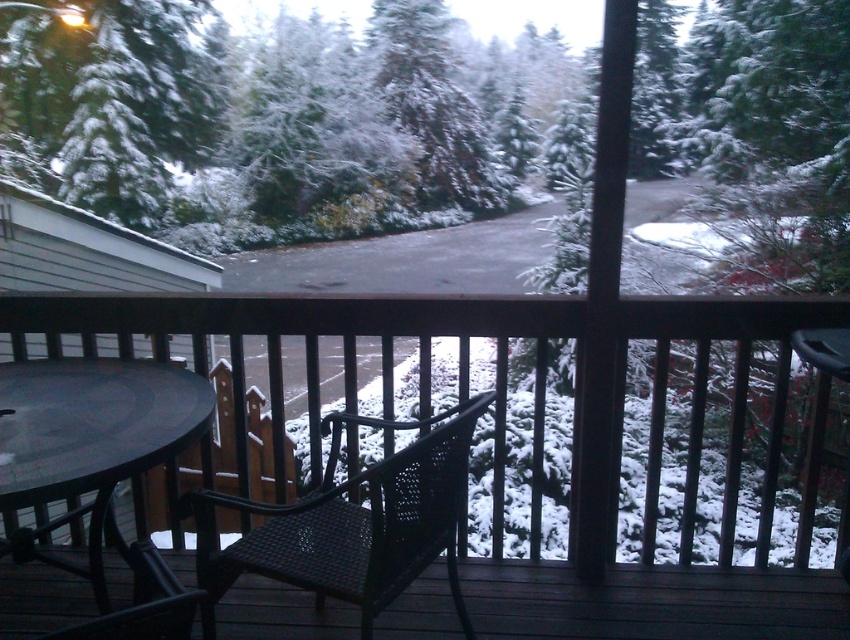
Question: In this image, where is matte black chair at center located relative to black matte table at lower left?

Choices:
 (A) above
 (B) below

Answer: (A)

Question: Which of the following is the farthest from the observer?

Choices:
 (A) (15, 460)
 (B) (697, 298)
 (C) (446, 522)

Answer: (B)

Question: Which object is farther from the camera taking this photo?

Choices:
 (A) black mesh chair at center
 (B) black matte table at lower left
 (C) black wicker chair at center
 (D) matte black chair at center

Answer: (D)

Question: In this image, where is matte black chair at center located relative to black matte table at lower left?

Choices:
 (A) right
 (B) left

Answer: (A)

Question: Can you confirm if matte black chair at center is smaller than black matte table at lower left?

Choices:
 (A) no
 (B) yes

Answer: (A)

Question: Which of these objects is positioned farthest from the black mesh chair at center?

Choices:
 (A) matte black chair at center
 (B) black wicker chair at center

Answer: (B)